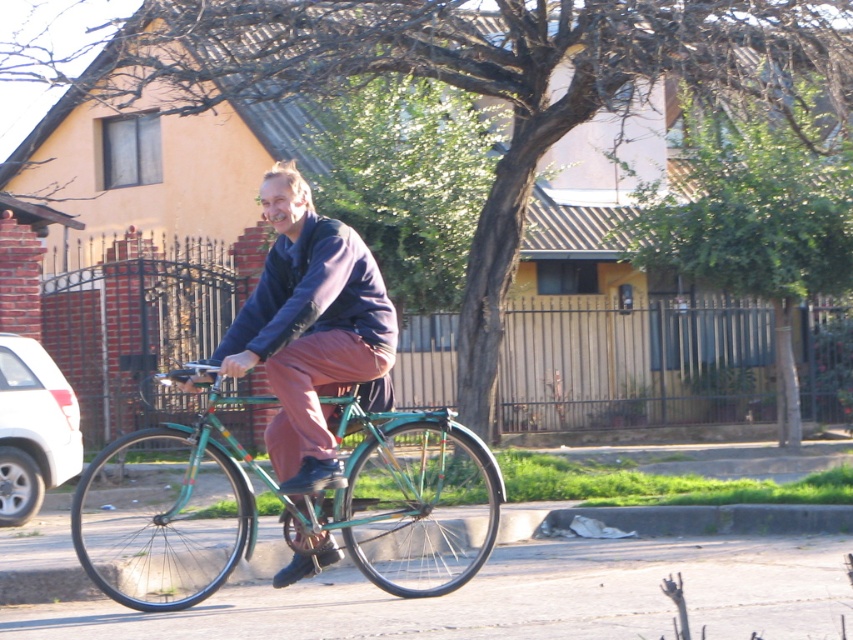
Who is taller, green metallic bicycle at center or dark blue fleece jacket at center?

With more height is dark blue fleece jacket at center.

Which is above, green metallic bicycle at center or dark blue fleece jacket at center?

dark blue fleece jacket at center is above.

What do you see at coordinates (409, 500) in the screenshot?
I see `green metallic bicycle at center` at bounding box center [409, 500].

This screenshot has width=853, height=640. What are the coordinates of `green metallic bicycle at center` in the screenshot? It's located at (409, 500).